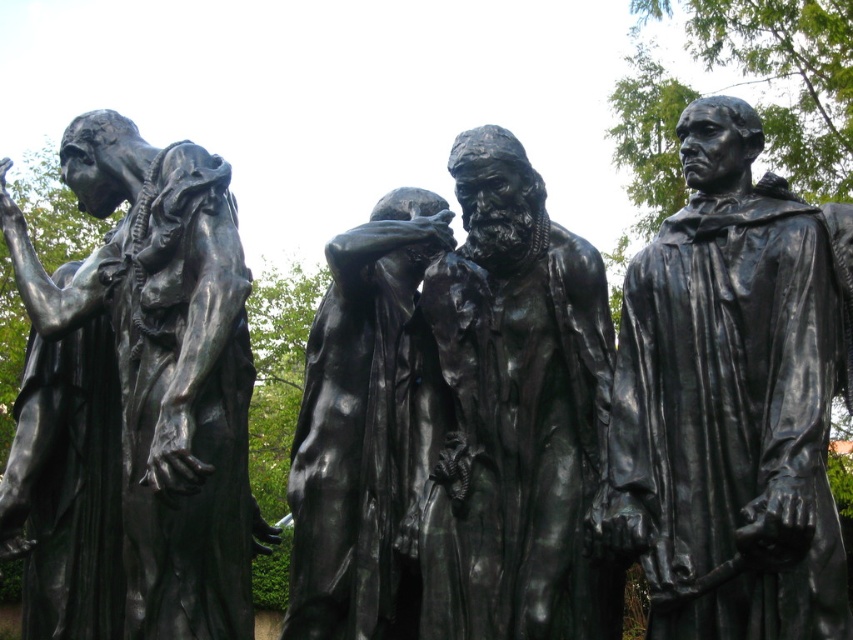
Who is shorter, bronze statue at left or polished bronze statue at center?

Standing shorter between the two is polished bronze statue at center.

Where is `bronze statue at left`? The height and width of the screenshot is (640, 853). bronze statue at left is located at coordinates (164, 368).

Between point (488, 349) and point (306, 625), which one is positioned behind?

Positioned behind is point (306, 625).

Locate an element on the screen. This screenshot has width=853, height=640. black bronze statue at center is located at coordinates (515, 413).

Can you confirm if bronze statue at center is positioned below polished bronze statue at center?

Actually, bronze statue at center is above polished bronze statue at center.

Consider the image. Does bronze statue at center have a greater height compared to polished bronze statue at center?

Yes, bronze statue at center is taller than polished bronze statue at center.

The width and height of the screenshot is (853, 640). I want to click on bronze statue at center, so click(729, 403).